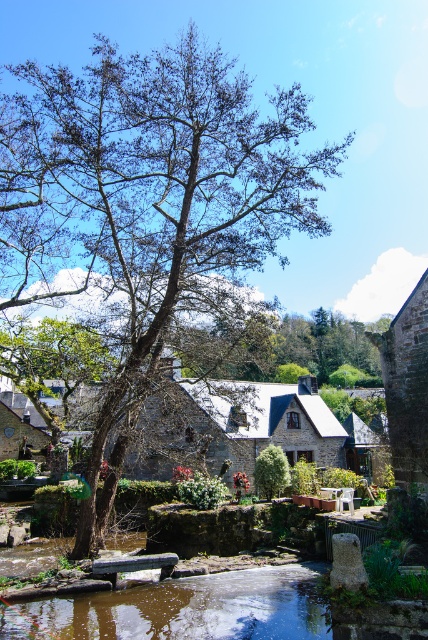
Question: Which of the following is the farthest from the observer?

Choices:
 (A) (8, 109)
 (B) (163, 444)
 (C) (269, 474)
 (D) (109, 576)

Answer: (B)

Question: Which point appears farthest from the camera in this image?

Choices:
 (A) (149, 566)
 (B) (287, 460)
 (C) (338, 397)

Answer: (C)

Question: Is stone village at center further to the viewer compared to green wooden bench at center?

Choices:
 (A) yes
 (B) no

Answer: (A)

Question: Can you confirm if bare wood tree at center is positioned to the right of green wooden bench at center?

Choices:
 (A) no
 (B) yes

Answer: (A)

Question: Does bare wood tree at center appear on the right side of green wooden bench at center?

Choices:
 (A) no
 (B) yes

Answer: (A)

Question: Which object is farther from the camera taking this photo?

Choices:
 (A) bare wood tree at center
 (B) stone village at center
 (C) green leafy tree at center

Answer: (C)